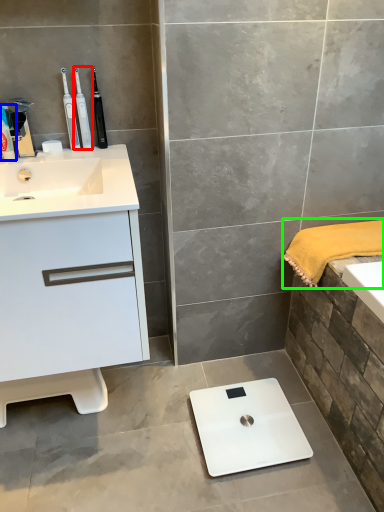
Question: Which object is the farthest from toothbrush (highlighted by a red box)? Choose among these: toiletry (highlighted by a blue box) or bath towel (highlighted by a green box).

Choices:
 (A) toiletry
 (B) bath towel

Answer: (B)